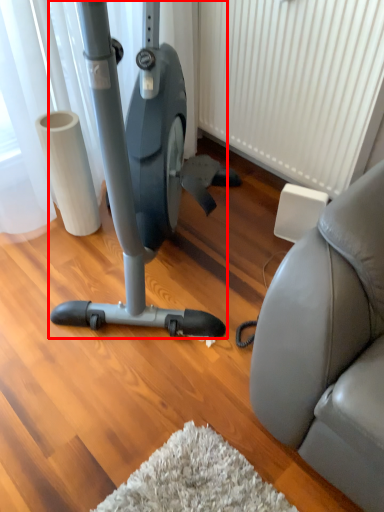
Question: Where is stationary bicycle (annotated by the red box) located in relation to radiator in the image?

Choices:
 (A) right
 (B) left

Answer: (B)